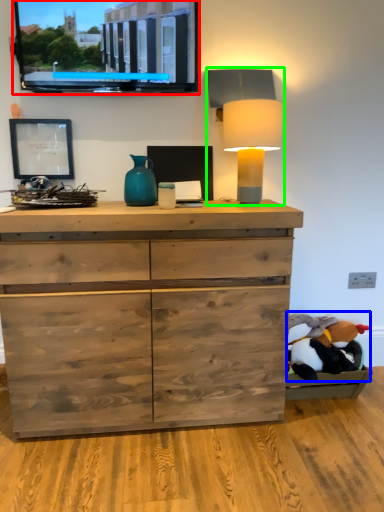
Question: Estimate the real-world distances between objects in this image. Which object is farther from computer monitor (highlighted by a red box), animal (highlighted by a blue box) or table lamp (highlighted by a green box)?

Choices:
 (A) animal
 (B) table lamp

Answer: (A)